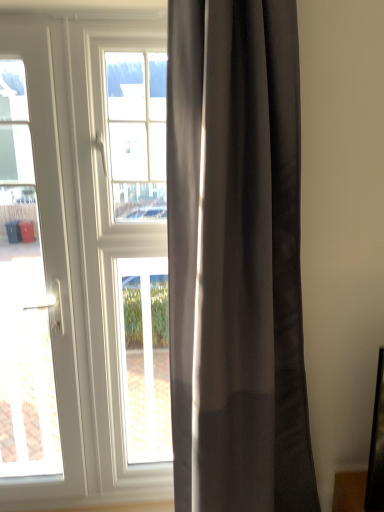
Question: Does white glossy door at left have a greater width compared to white glass window at center?

Choices:
 (A) yes
 (B) no

Answer: (A)

Question: From a real-world perspective, is white glossy door at left below white glass window at center?

Choices:
 (A) yes
 (B) no

Answer: (A)

Question: Would you say white glossy door at left is a long distance from white glass window at center?

Choices:
 (A) yes
 (B) no

Answer: (B)

Question: Considering the relative sizes of white glossy door at left and white glass window at center in the image provided, is white glossy door at left taller than white glass window at center?

Choices:
 (A) yes
 (B) no

Answer: (A)

Question: Is white glossy door at left further to the viewer compared to white glass window at center?

Choices:
 (A) no
 (B) yes

Answer: (A)

Question: Is white glossy door at left completely or partially outside of white glass window at center?

Choices:
 (A) no
 (B) yes

Answer: (B)

Question: Is white glossy door at left outside of satin gray curtain at center?

Choices:
 (A) no
 (B) yes

Answer: (B)

Question: Does white glossy door at left have a lesser height compared to satin gray curtain at center?

Choices:
 (A) no
 (B) yes

Answer: (A)

Question: Is white glossy door at left facing away from satin gray curtain at center?

Choices:
 (A) no
 (B) yes

Answer: (A)

Question: Is there a large distance between white glossy door at left and satin gray curtain at center?

Choices:
 (A) no
 (B) yes

Answer: (A)

Question: Is white glossy door at left at the left side of satin gray curtain at center?

Choices:
 (A) yes
 (B) no

Answer: (A)

Question: From a real-world perspective, is white glossy door at left on satin gray curtain at center?

Choices:
 (A) no
 (B) yes

Answer: (A)

Question: Is white glass window at center smaller than clear glass window at center?

Choices:
 (A) no
 (B) yes

Answer: (A)